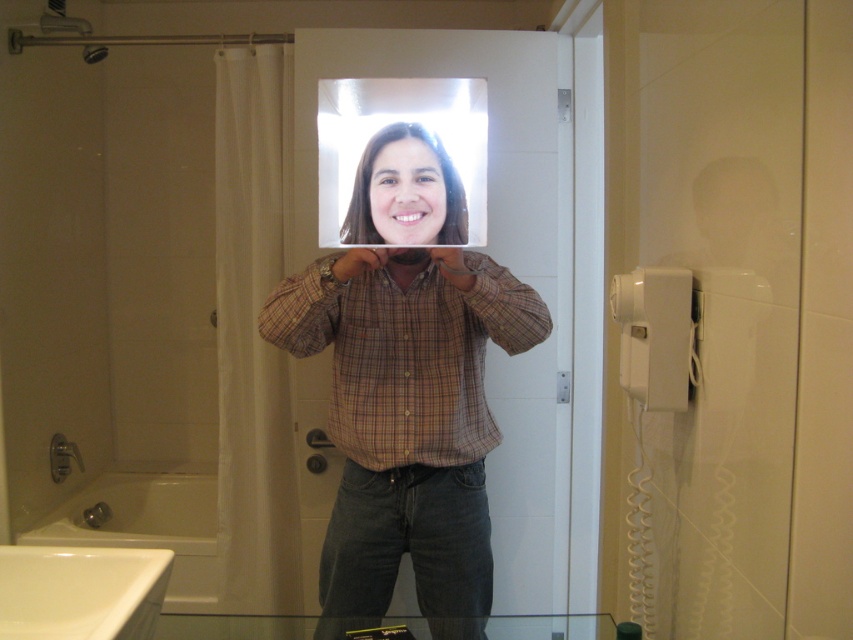
From the picture: Between matte plastic tablet at center and clear plastic mirror at center, which one is positioned lower?

Positioned lower is matte plastic tablet at center.

Is matte plastic tablet at center wider than clear plastic mirror at center?

Indeed, matte plastic tablet at center has a greater width compared to clear plastic mirror at center.

You are a GUI agent. You are given a task and a screenshot of the screen. Output one action in this format:
    pyautogui.click(x=<x>, y=<y>)
    Task: Click on the matte plastic tablet at center
    
    Given the screenshot: What is the action you would take?
    pyautogui.click(x=407, y=416)

Locate an element on the screen. matte plastic tablet at center is located at coordinates (407, 416).